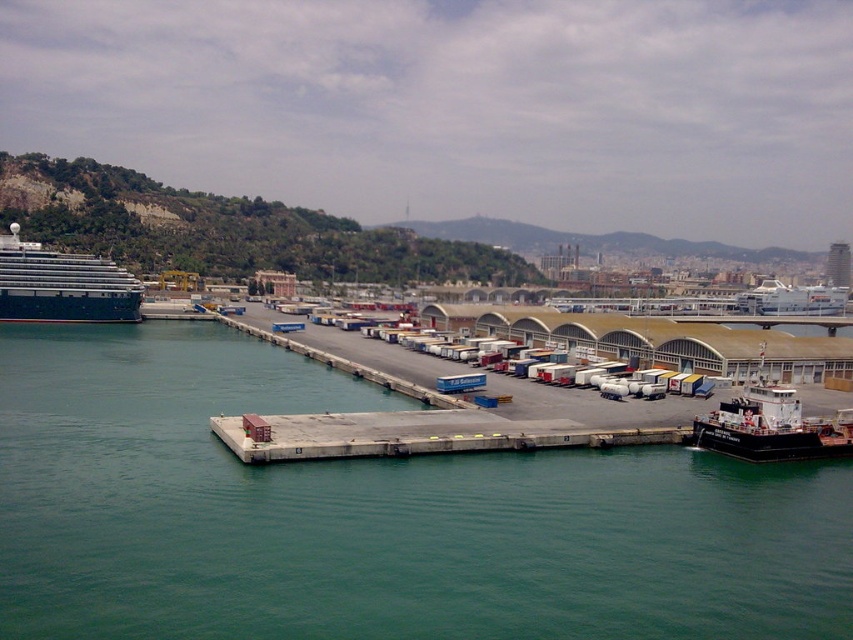
Where is `green water at lower left`? green water at lower left is located at coordinates (372, 515).

Which is in front, point (611, 513) or point (325, 419)?

Point (611, 513) is more forward.

At what (x,y) coordinates should I click in order to perform the action: click on green water at lower left. Please return your answer as a coordinate pair (x, y). The width and height of the screenshot is (853, 640). Looking at the image, I should click on (372, 515).

Does gray concrete dock at center have a smaller size compared to black matte tugboat at lower right?

Yes, gray concrete dock at center is smaller than black matte tugboat at lower right.

Can you confirm if gray concrete dock at center is positioned above black matte tugboat at lower right?

Actually, gray concrete dock at center is below black matte tugboat at lower right.

Is point (520, 440) more distant than point (776, 394)?

No, (520, 440) is closer to viewer.

Find the location of `gray concrete dock at center`. gray concrete dock at center is located at coordinates (416, 435).

Who is more distant from viewer, (558,612) or (84,269)?

Point (84,269)

Measure the distance between green water at lower left and camera.

green water at lower left and camera are 25.87 meters apart.

Where is `green water at lower left`? Image resolution: width=853 pixels, height=640 pixels. green water at lower left is located at coordinates (372, 515).